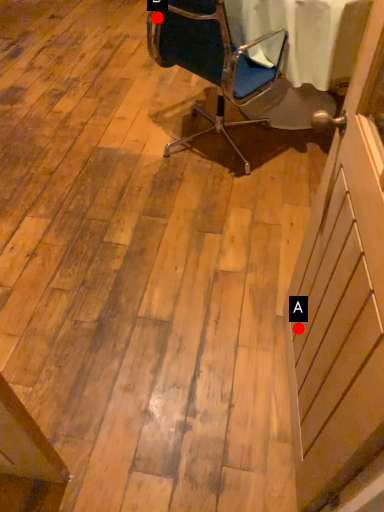
Question: Two points are circled on the image, labeled by A and B beside each circle. Which point appears farthest from the camera in this image?

Choices:
 (A) A is further
 (B) B is further

Answer: (B)